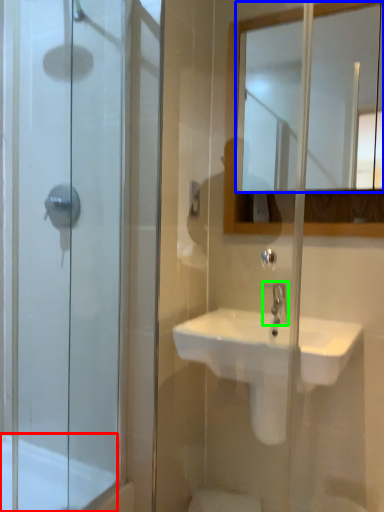
Question: Estimate the real-world distances between objects in this image. Which object is farther from bath (highlighted by a red box), mirror (highlighted by a blue box) or tap (highlighted by a green box)?

Choices:
 (A) mirror
 (B) tap

Answer: (A)